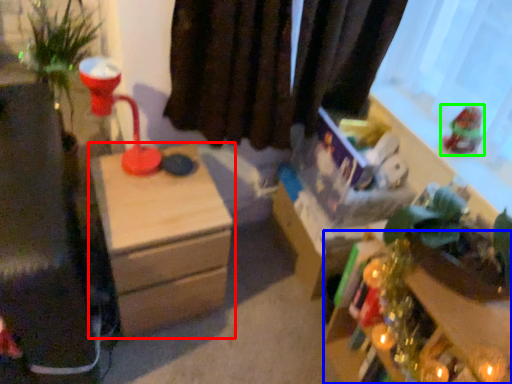
Question: Which is farther away from nightstand (highlighted by a red box)? table (highlighted by a blue box) or toy (highlighted by a green box)?

Choices:
 (A) table
 (B) toy

Answer: (B)